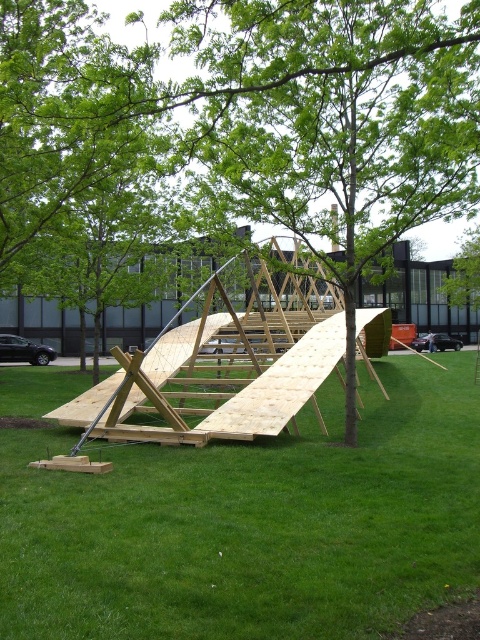
You are standing in the park and see the green grassy at center and the green leafy tree at center. Which one is closer to the ground?

The green grassy at center is closer to the ground because it is located below the green leafy tree at center.

You are standing in the park and see the green grassy at center and the green leafy tree at center. Which one is closer to you?

The green grassy at center is closer to you because it is in front of the green leafy tree at center.